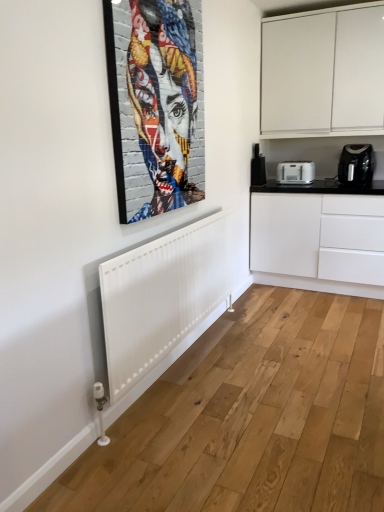
Question: Does black glossy countertop at right come behind white matte cabinet at upper right?

Choices:
 (A) no
 (B) yes

Answer: (B)

Question: From a real-world perspective, is black glossy countertop at right on top of white matte cabinet at upper right?

Choices:
 (A) yes
 (B) no

Answer: (B)

Question: Can you confirm if black glossy countertop at right is bigger than white matte cabinet at upper right?

Choices:
 (A) no
 (B) yes

Answer: (B)

Question: Considering the relative sizes of black glossy countertop at right and white matte cabinet at upper right in the image provided, is black glossy countertop at right taller than white matte cabinet at upper right?

Choices:
 (A) no
 (B) yes

Answer: (A)

Question: Is black glossy countertop at right at the right side of white matte cabinet at upper right?

Choices:
 (A) no
 (B) yes

Answer: (B)

Question: In terms of height, does colorful mosaic portrait at upper center look taller or shorter compared to black plastic coffee machine at right?

Choices:
 (A) tall
 (B) short

Answer: (A)

Question: Considering their positions, is colorful mosaic portrait at upper center located in front of or behind black plastic coffee machine at right?

Choices:
 (A) behind
 (B) front

Answer: (B)

Question: Is colorful mosaic portrait at upper center situated inside black plastic coffee machine at right or outside?

Choices:
 (A) inside
 (B) outside

Answer: (B)

Question: From the image's perspective, is colorful mosaic portrait at upper center positioned above or below black plastic coffee machine at right?

Choices:
 (A) above
 (B) below

Answer: (A)

Question: Considering the positions of colorful mosaic portrait at upper center and white matte cabinet at upper right in the image, is colorful mosaic portrait at upper center bigger or smaller than white matte cabinet at upper right?

Choices:
 (A) big
 (B) small

Answer: (B)

Question: Is point (190, 114) positioned closer to the camera than point (321, 126)?

Choices:
 (A) farther
 (B) closer

Answer: (B)

Question: Looking at their shapes, would you say colorful mosaic portrait at upper center is wider or thinner than white matte cabinet at upper right?

Choices:
 (A) wide
 (B) thin

Answer: (B)

Question: Is colorful mosaic portrait at upper center inside the boundaries of white matte cabinet at upper right, or outside?

Choices:
 (A) outside
 (B) inside

Answer: (A)

Question: From a real-world perspective, relative to black plastic coffee machine at right, is black glossy countertop at right vertically above or below?

Choices:
 (A) below
 (B) above

Answer: (A)

Question: Considering the positions of black glossy countertop at right and black plastic coffee machine at right in the image, is black glossy countertop at right wider or thinner than black plastic coffee machine at right?

Choices:
 (A) thin
 (B) wide

Answer: (B)